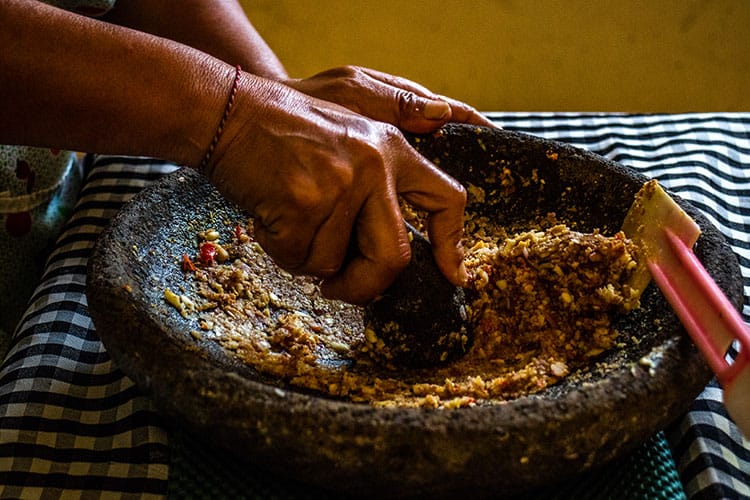
Locate an element on the screen. bowl is located at coordinates (166, 331).